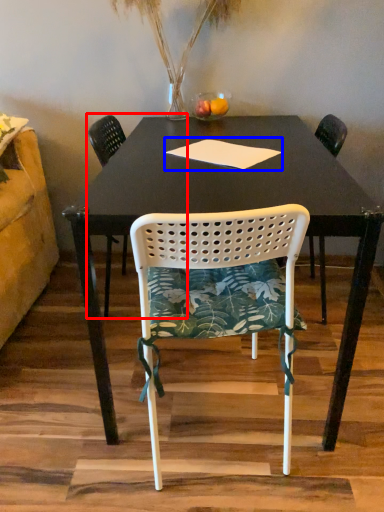
Question: Which of the following is the farthest to the observer, chair (highlighted by a red box) or notepad (highlighted by a blue box)?

Choices:
 (A) chair
 (B) notepad

Answer: (A)